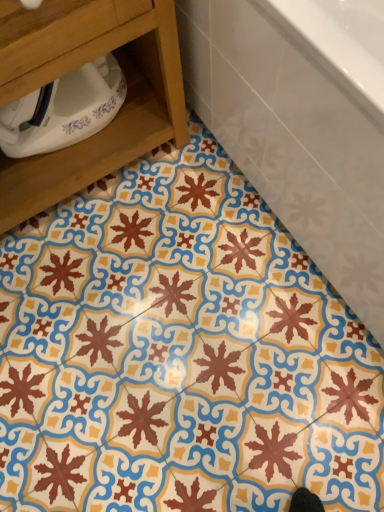
Question: Is wooden drawer at lower left not near white glossy bathtub at upper right?

Choices:
 (A) yes
 (B) no

Answer: (B)

Question: Does wooden drawer at lower left contain white glossy bathtub at upper right?

Choices:
 (A) yes
 (B) no

Answer: (B)

Question: Does wooden drawer at lower left have a lesser height compared to white glossy bathtub at upper right?

Choices:
 (A) no
 (B) yes

Answer: (A)

Question: Can you confirm if wooden drawer at lower left is taller than white glossy bathtub at upper right?

Choices:
 (A) no
 (B) yes

Answer: (B)

Question: From a real-world perspective, is wooden drawer at lower left below white glossy bathtub at upper right?

Choices:
 (A) yes
 (B) no

Answer: (B)

Question: Is wooden drawer at lower left outside white glossy bathtub at upper right?

Choices:
 (A) yes
 (B) no

Answer: (A)

Question: Does white glossy bathtub at upper right have a greater height compared to wooden drawer at lower left?

Choices:
 (A) yes
 (B) no

Answer: (B)

Question: Is white glossy bathtub at upper right shorter than wooden drawer at lower left?

Choices:
 (A) no
 (B) yes

Answer: (B)

Question: Considering the relative sizes of white glossy bathtub at upper right and wooden drawer at lower left in the image provided, is white glossy bathtub at upper right thinner than wooden drawer at lower left?

Choices:
 (A) yes
 (B) no

Answer: (B)

Question: Is white glossy bathtub at upper right far from wooden drawer at lower left?

Choices:
 (A) no
 (B) yes

Answer: (A)

Question: From the image's perspective, is white glossy bathtub at upper right beneath wooden drawer at lower left?

Choices:
 (A) yes
 (B) no

Answer: (B)

Question: Is white glossy bathtub at upper right to the left of wooden drawer at lower left from the viewer's perspective?

Choices:
 (A) yes
 (B) no

Answer: (B)

Question: From a real-world perspective, relative to white glossy bathtub at upper right, is wooden drawer at lower left vertically above or below?

Choices:
 (A) above
 (B) below

Answer: (A)